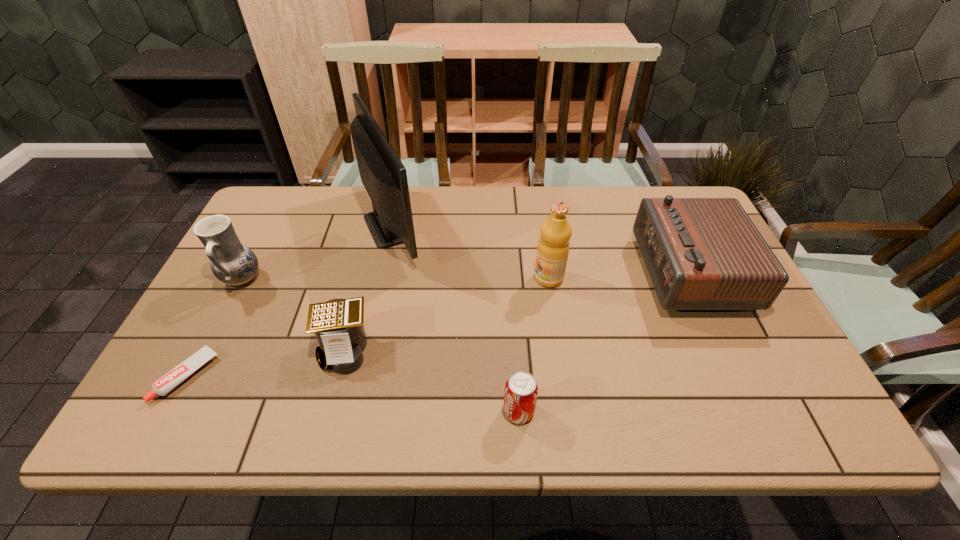
At what (x,y) coordinates should I click in order to perform the action: click on vacant space at the right edge of the desktop. Please return your answer as a coordinate pair (x, y). Looking at the image, I should click on (760, 366).

In the image, there is a desktop. At what (x,y) coordinates should I click in order to perform the action: click on vacant space at the far left corner. Please return your answer as a coordinate pair (x, y). Image resolution: width=960 pixels, height=540 pixels. Looking at the image, I should click on (283, 210).

This screenshot has height=540, width=960. In order to click on free spot between the fruit juice and the radio receiver in this screenshot , I will do `click(618, 275)`.

At what (x,y) coordinates should I click in order to perform the action: click on free area in between the rightmost object and the sixth shortest object. Please return your answer as a coordinate pair (x, y). This screenshot has width=960, height=540. Looking at the image, I should click on (618, 275).

The height and width of the screenshot is (540, 960). I want to click on vacant point located between the soda and the calculator, so click(x=432, y=380).

Identify the location of vacant space that is in between the radio receiver and the shortest object. (438, 324).

Find the location of a particular element. This screenshot has width=960, height=540. free space between the radio receiver and the toothpaste is located at coordinates (438, 324).

In order to click on vacant area that lies between the calculator and the shortest object in this screenshot , I will do `click(266, 363)`.

Find the location of `vacant point located between the soda and the calculator`. vacant point located between the soda and the calculator is located at coordinates (432, 380).

The image size is (960, 540). I want to click on free space between the tallest object and the toothpaste, so click(x=290, y=301).